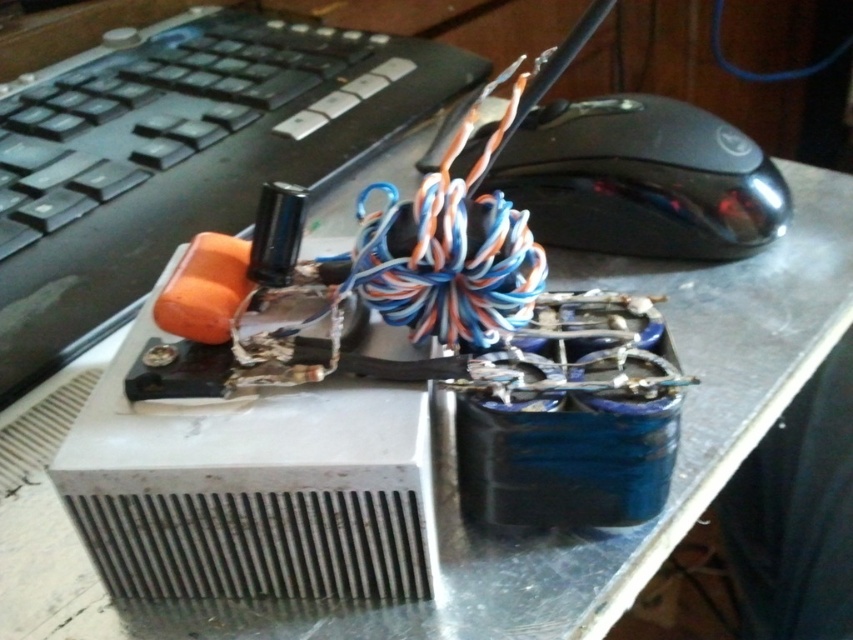
Question: Which object is closer to the camera taking this photo?

Choices:
 (A) black plastic keyboard at upper left
 (B) black glossy mouse at upper right

Answer: (A)

Question: Can you confirm if black plastic keyboard at upper left is thinner than black glossy mouse at upper right?

Choices:
 (A) yes
 (B) no

Answer: (B)

Question: Among these points, which one is nearest to the camera?

Choices:
 (A) (125, 180)
 (B) (596, 115)

Answer: (B)

Question: Can you confirm if black plastic keyboard at upper left is positioned to the left of black glossy mouse at upper right?

Choices:
 (A) no
 (B) yes

Answer: (B)

Question: Is black plastic keyboard at upper left to the right of black glossy mouse at upper right from the viewer's perspective?

Choices:
 (A) no
 (B) yes

Answer: (A)